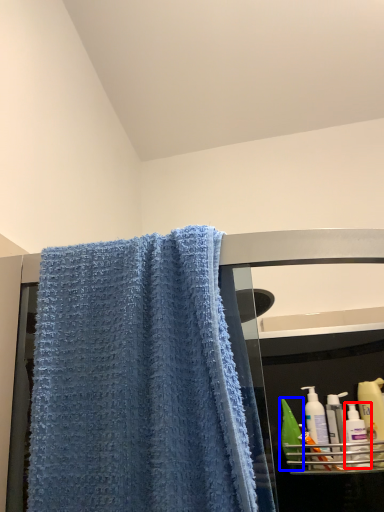
Question: Which point is further to the camera, cleaning product (highlighted by a red box) or mouthwash (highlighted by a blue box)?

Choices:
 (A) cleaning product
 (B) mouthwash

Answer: (B)